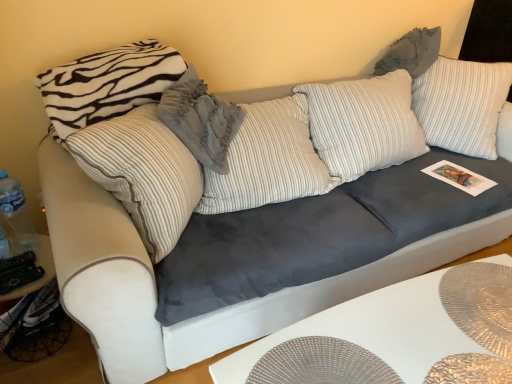
The width and height of the screenshot is (512, 384). Find the location of `empty space that is ontop of white textured placemat at lower right (from a real-world perspective)`. empty space that is ontop of white textured placemat at lower right (from a real-world perspective) is located at coordinates (415, 327).